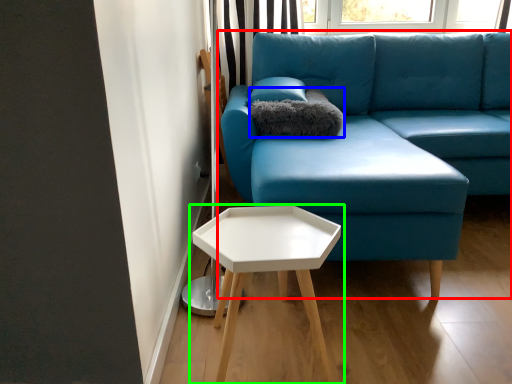
Question: Considering the real-world distances, which object is closest to studio couch (highlighted by a red box)? pillow (highlighted by a blue box) or table (highlighted by a green box).

Choices:
 (A) pillow
 (B) table

Answer: (A)